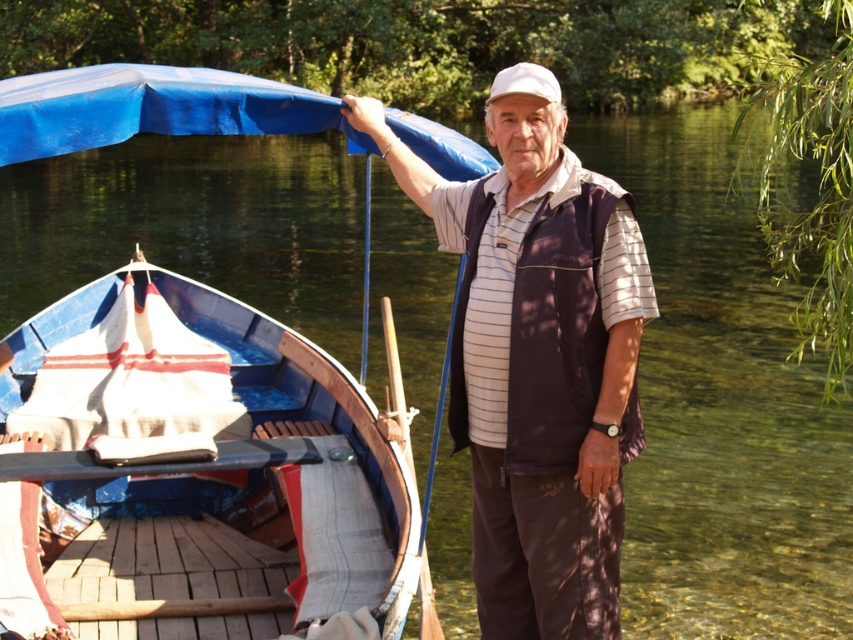
Looking at this image, you are a photographer positioned at the riverside. You need to capture a photo that includes both the blue painted wood boat at left and the white matte baseball cap at upper center. Which object should you adjust your camera angle to focus on first to ensure both are in frame?

The blue painted wood boat at left is closer to you than the white matte baseball cap at upper center, so you should focus on the blue painted wood boat at left first to ensure both are in frame.

You are a fashion designer analyzing the man in the image. You need to determine the spatial relationship between the brown fabric vest at center and the white matte baseball cap at upper center. Which item is positioned higher on the man?

The white matte baseball cap at upper center is positioned higher on the man than the brown fabric vest at center, as it is located above the vest.

You are a photographer trying to capture both the blue painted wood boat at left and the white matte baseball cap at upper center in the same frame. Since you want to emphasize the size difference between them, which object should you position closer to the camera to achieve this effect?

To emphasize the size difference between the blue painted wood boat at left and the white matte baseball cap at upper center, position the blue painted wood boat at left closer to the camera since it is bigger than the white matte baseball cap at upper center.